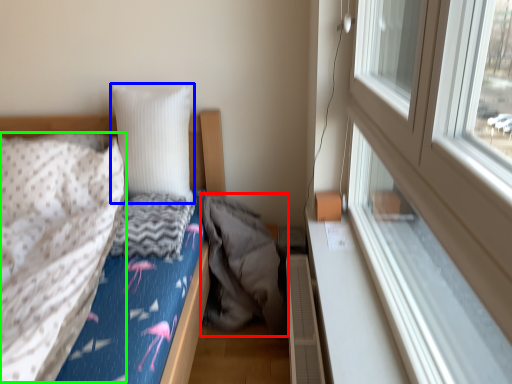
Question: Which object is the farthest from sleeping bag (highlighted by a red box)? Choose among these: pillow (highlighted by a blue box) or blanket (highlighted by a green box).

Choices:
 (A) pillow
 (B) blanket

Answer: (B)